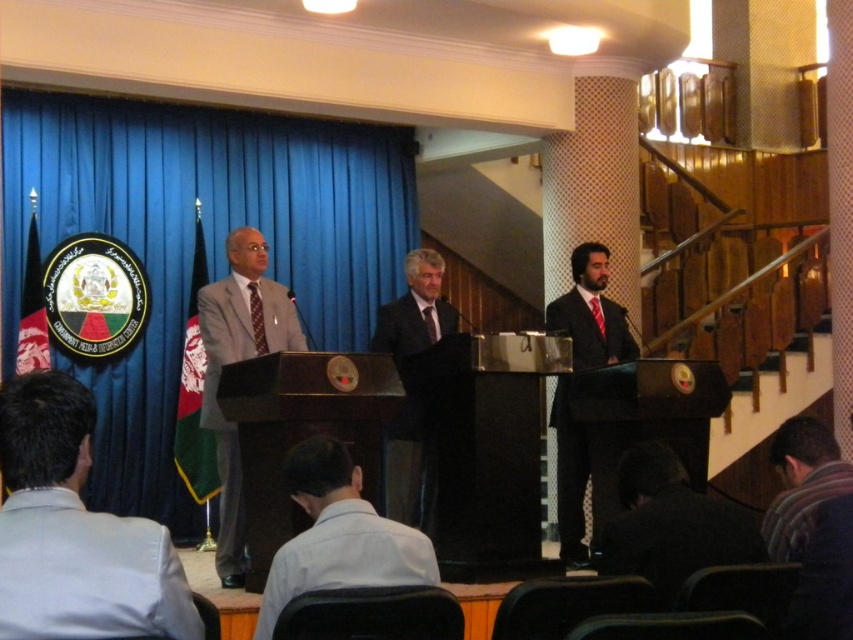
Who is taller, matte black suit at right or dark suit at center?

matte black suit at right

This screenshot has width=853, height=640. I want to click on matte black suit at right, so click(x=590, y=312).

Find the location of a particular element. The width and height of the screenshot is (853, 640). matte black suit at right is located at coordinates (590, 312).

Who is lower down, light gray suit at lower left or matte black suit at right?

matte black suit at right is lower down.

I want to click on light gray suit at lower left, so click(x=74, y=531).

Can you confirm if white fabric shirt at lower center is shorter than matte black suit at right?

Yes.

The width and height of the screenshot is (853, 640). I want to click on white fabric shirt at lower center, so click(x=338, y=536).

Where is `white fabric shirt at lower center`? This screenshot has height=640, width=853. white fabric shirt at lower center is located at coordinates (338, 536).

You are a GUI agent. You are given a task and a screenshot of the screen. Output one action in this format:
    pyautogui.click(x=<x>, y=<y>)
    Task: Click on the white fabric shirt at lower center
    This screenshot has height=640, width=853.
    Given the screenshot: What is the action you would take?
    pyautogui.click(x=338, y=536)